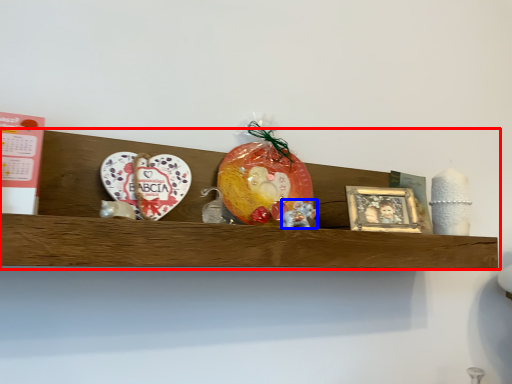
Question: Which point is closer to the camera, shelf (highlighted by a red box) or stuff (highlighted by a blue box)?

Choices:
 (A) shelf
 (B) stuff

Answer: (A)